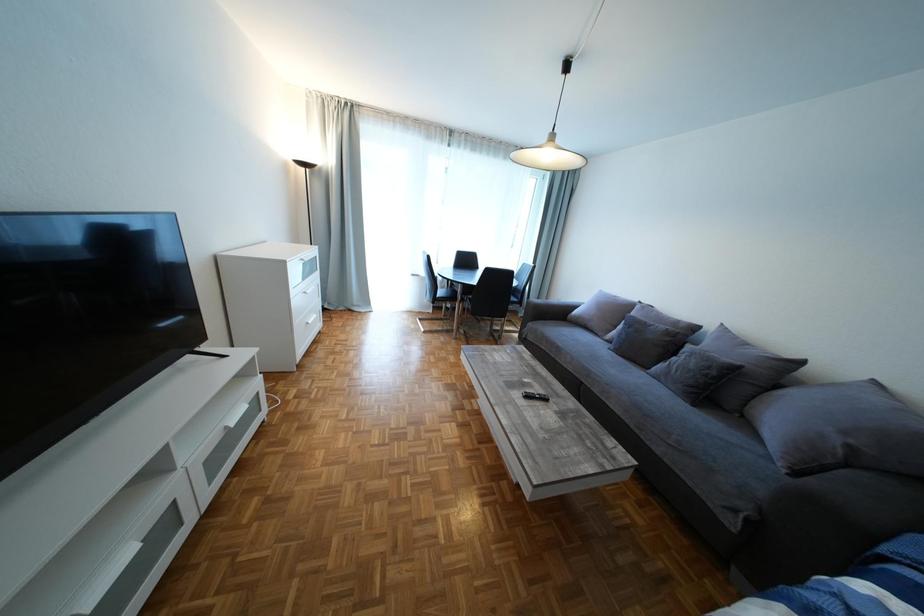
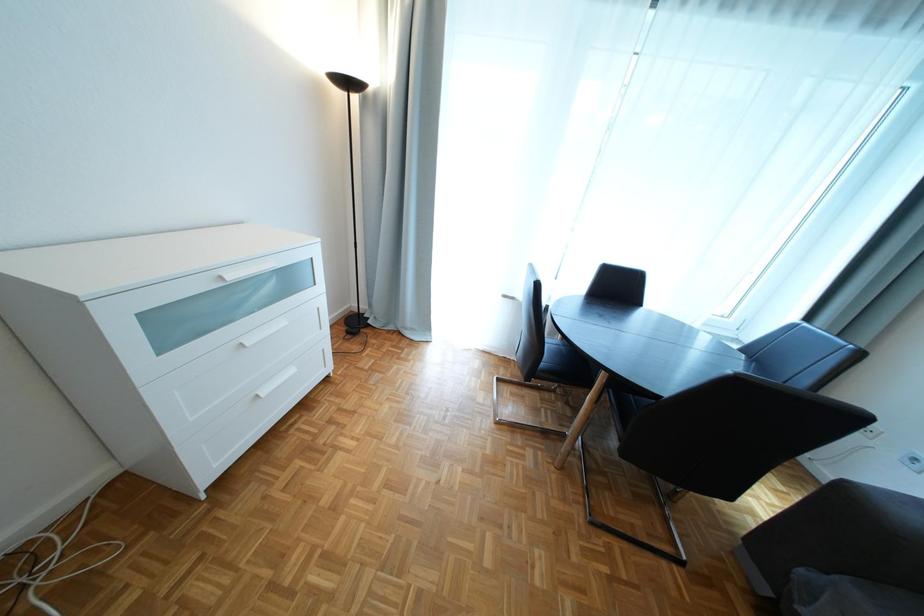
Question: The images are taken continuously from a first-person perspective. In which direction are you moving?

Choices:
 (A) Left
 (B) Right
 (C) Forward
 (D) Backward

Answer: (C)